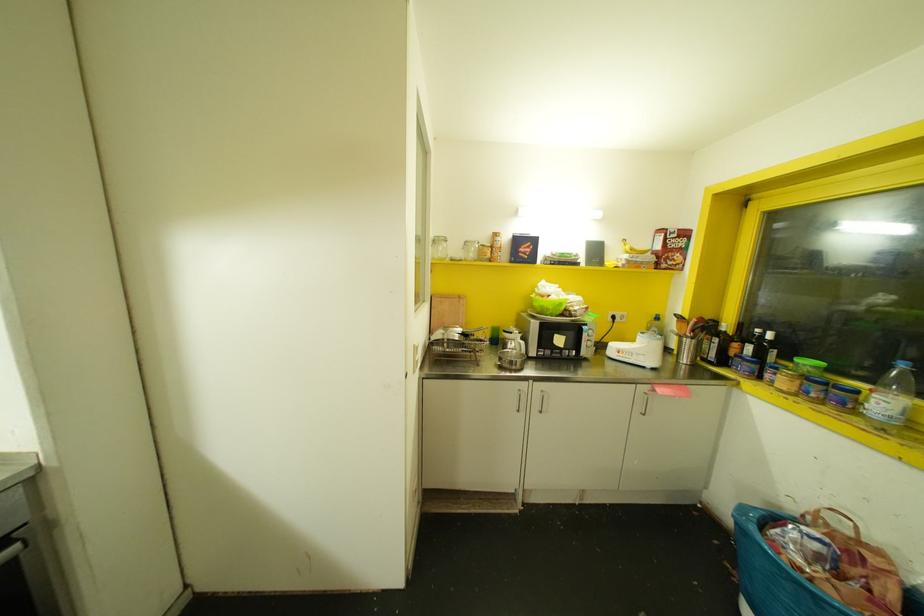
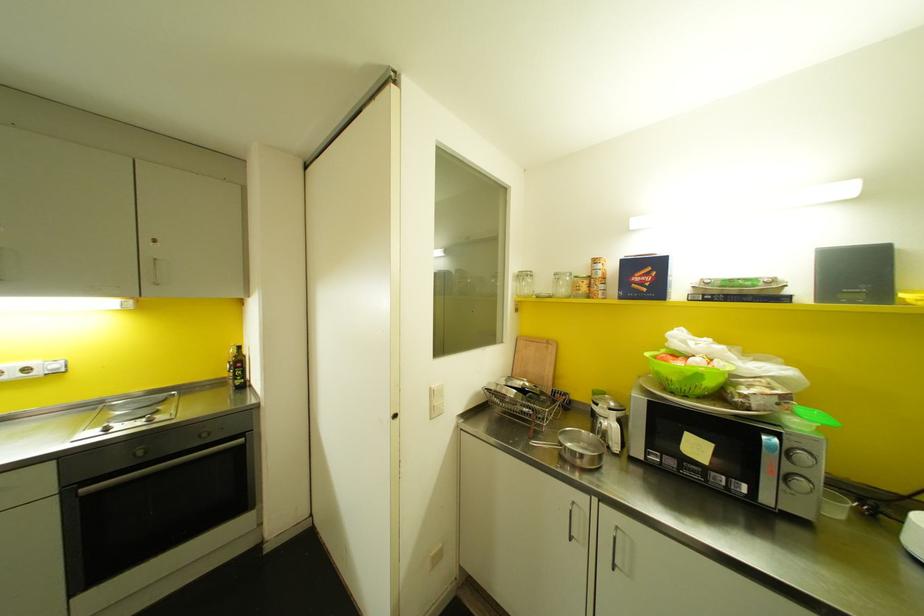
Locate, in the second image, the point that corresponds to (560,304) in the first image.

(698, 376)